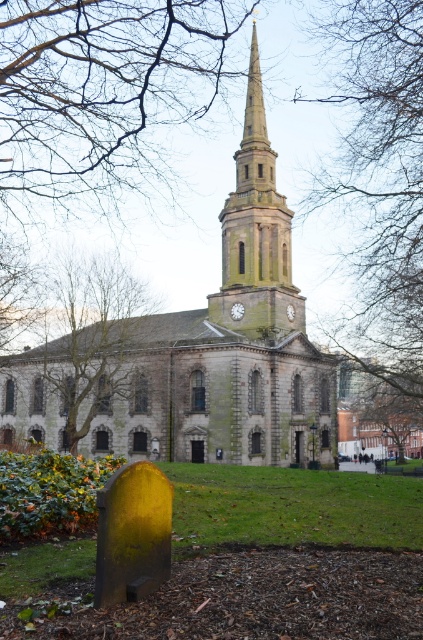
Question: Observing the image, what is the correct spatial positioning of stone church at center in reference to bare branches at upper center?

Choices:
 (A) left
 (B) right

Answer: (A)

Question: Which point appears closest to the camera in this image?

Choices:
 (A) (164, 336)
 (B) (417, 260)
 (C) (280, 276)
 (D) (66, 296)

Answer: (B)

Question: Which point is closer to the camera taking this photo?

Choices:
 (A) (225, 276)
 (B) (384, 212)
 (C) (274, 355)
 (D) (79, 396)

Answer: (C)

Question: Is brown textured tree at left below smooth stone steeple at center?

Choices:
 (A) yes
 (B) no

Answer: (A)

Question: Is brown textured tree at left closer to the viewer compared to smooth stone steeple at center?

Choices:
 (A) yes
 (B) no

Answer: (A)

Question: Which of these objects is positioned farthest from the brown textured tree at left?

Choices:
 (A) bare branches at upper center
 (B) smooth stone steeple at center

Answer: (A)